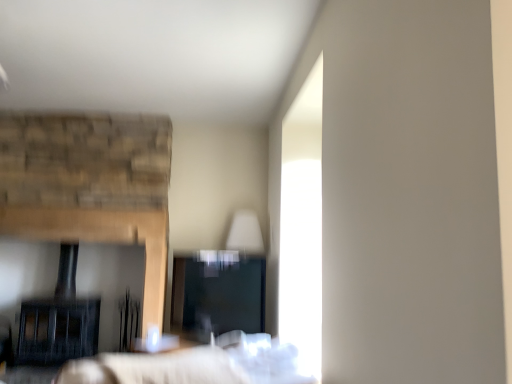
Locate an element on the screen. Image resolution: width=512 pixels, height=384 pixels. black matte fireplace at left is located at coordinates (85, 209).

Describe the element at coordinates (85, 209) in the screenshot. The image size is (512, 384). I see `black matte fireplace at left` at that location.

Identify the location of white fabric bed at center. This screenshot has width=512, height=384. (197, 364).

What is the approximate height of white fabric bed at center?

The height of white fabric bed at center is 13.20 inches.

Measure the distance between white fabric bed at center and camera.

The depth of white fabric bed at center is 8.30 feet.

Describe the element at coordinates (197, 364) in the screenshot. I see `white fabric bed at center` at that location.

Identify the location of black matte fireplace at left. (85, 209).

Looking at this image, can you confirm if white fabric bed at center is positioned to the left of black matte fireplace at left?

No, white fabric bed at center is not to the left of black matte fireplace at left.

Is white fabric bed at center closer to the viewer compared to black matte fireplace at left?

Yes, white fabric bed at center is closer to the camera.

Is point (159, 363) closer to viewer compared to point (16, 121)?

Yes, it is in front of point (16, 121).

From the image's perspective, is white fabric bed at center located above black matte fireplace at left?

Indeed, from the image's perspective, white fabric bed at center is shown above black matte fireplace at left.

From a real-world perspective, is white fabric bed at center located higher than black matte fireplace at left?

No.

Considering the sizes of white fabric bed at center and black matte fireplace at left in the image, is white fabric bed at center wider or thinner than black matte fireplace at left?

In the image, white fabric bed at center appears to be wider than black matte fireplace at left.

Which of these two, white fabric bed at center or black matte fireplace at left, stands taller?

With more height is black matte fireplace at left.

From the picture: Which of these two, white fabric bed at center or black matte fireplace at left, is smaller?

white fabric bed at center is smaller.

Could black matte fireplace at left be considered to be inside white fabric bed at center?

Definitely not — black matte fireplace at left is not inside white fabric bed at center.

Are white fabric bed at center and black matte fireplace at left located far from each other?

white fabric bed at center is positioned a significant distance from black matte fireplace at left.

Could you tell me if white fabric bed at center is turned towards black matte fireplace at left?

Yes.

Image resolution: width=512 pixels, height=384 pixels. Identify the location of fireplace behind the white fabric bed at center. (85, 209).

Considering the positions of objects black matte fireplace at left and white fabric bed at center in the image provided, who is more to the left, black matte fireplace at left or white fabric bed at center?

Positioned to the left is black matte fireplace at left.

Is the position of black matte fireplace at left more distant than that of white fabric bed at center?

That is True.

Which is closer to the camera, (46, 147) or (260, 353)?

Point (46, 147) is farther from the camera than point (260, 353).

From the image's perspective, is black matte fireplace at left over white fabric bed at center?

Incorrect, from the image's perspective, black matte fireplace at left is lower than white fabric bed at center.

From a real-world perspective, is black matte fireplace at left located beneath white fabric bed at center?

No, from a real-world perspective, black matte fireplace at left is not beneath white fabric bed at center.

Which object is thinner, black matte fireplace at left or white fabric bed at center?

Thinner between the two is black matte fireplace at left.

Does black matte fireplace at left have a lesser height compared to white fabric bed at center?

No, black matte fireplace at left is not shorter than white fabric bed at center.

Between black matte fireplace at left and white fabric bed at center, which one has larger size?

black matte fireplace at left.

Is black matte fireplace at left not within white fabric bed at center?

Absolutely, black matte fireplace at left is external to white fabric bed at center.

Are black matte fireplace at left and white fabric bed at center far apart?

Yes, black matte fireplace at left and white fabric bed at center are quite far apart.

In the scene shown: Could you tell me if black matte fireplace at left is facing white fabric bed at center?

Yes, black matte fireplace at left is turned towards white fabric bed at center.

Where is `bed on the right of the black matte fireplace at left`? The height and width of the screenshot is (384, 512). bed on the right of the black matte fireplace at left is located at coordinates [x=197, y=364].

Where is `bed that appears on the right of black matte fireplace at left`? The width and height of the screenshot is (512, 384). bed that appears on the right of black matte fireplace at left is located at coordinates (197, 364).

The image size is (512, 384). What are the coordinates of `fireplace below the white fabric bed at center (from the image's perspective)` in the screenshot? It's located at (85, 209).